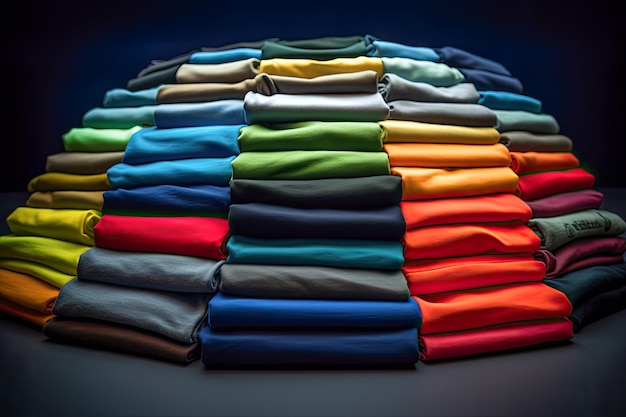
Where is `yellow and orange fabrics`? The height and width of the screenshot is (417, 626). yellow and orange fabrics is located at coordinates (339, 64), (86, 179), (85, 199), (81, 217), (396, 125), (399, 153), (422, 177), (441, 211), (528, 155).